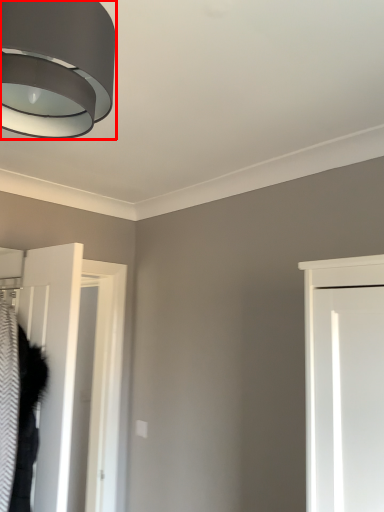
Question: From the image's perspective, considering the relative positions of lamp (annotated by the red box) and door in the image provided, where is lamp (annotated by the red box) located with respect to the staircase?

Choices:
 (A) above
 (B) below

Answer: (A)